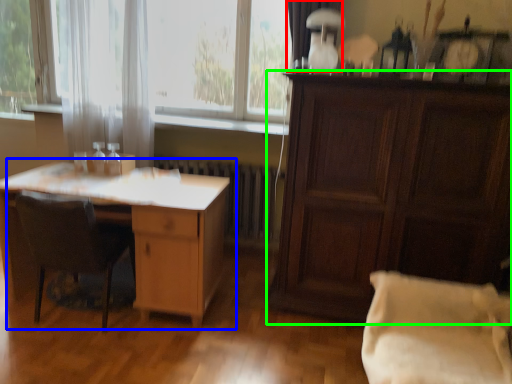
Question: Based on their relative distances, which object is farther from curtain (highlighted by a red box)? Choose from desk (highlighted by a blue box) and cabinetry (highlighted by a green box).

Choices:
 (A) desk
 (B) cabinetry

Answer: (A)